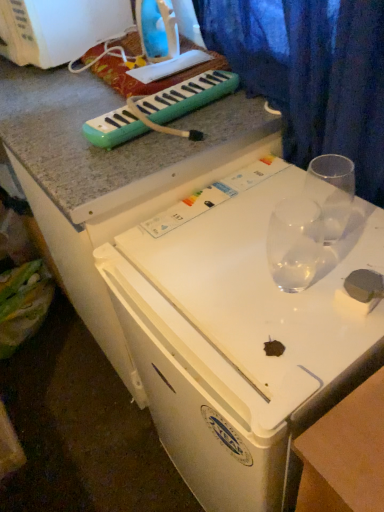
Question: Is transparent glass at upper right, which is the first martini glass in right-to-left order, surrounded by green plastic melodica at upper center?

Choices:
 (A) yes
 (B) no

Answer: (B)

Question: Considering the relative sizes of green plastic melodica at upper center and transparent glass at upper right, the 2th martini glass viewed from the left, in the image provided, is green plastic melodica at upper center bigger than transparent glass at upper right, the 2th martini glass viewed from the left,?

Choices:
 (A) yes
 (B) no

Answer: (A)

Question: From the image's perspective, would you say green plastic melodica at upper center is shown under transparent glass at upper right, which is the first martini glass in right-to-left order?

Choices:
 (A) yes
 (B) no

Answer: (B)

Question: Can you confirm if green plastic melodica at upper center is thinner than transparent glass at upper right, the 2th martini glass viewed from the left?

Choices:
 (A) no
 (B) yes

Answer: (A)

Question: Does green plastic melodica at upper center have a lesser height compared to transparent glass at upper right, which is the first martini glass in right-to-left order?

Choices:
 (A) yes
 (B) no

Answer: (A)

Question: In terms of height, does white plastic washing machine at upper left, which is the 1th appliance from left to right, look taller or shorter compared to blue fabric curtain at upper right?

Choices:
 (A) short
 (B) tall

Answer: (A)

Question: Based on their sizes in the image, would you say white plastic washing machine at upper left, which is the 1th appliance from left to right, is bigger or smaller than blue fabric curtain at upper right?

Choices:
 (A) big
 (B) small

Answer: (B)

Question: Is point (64, 31) positioned closer to the camera than point (301, 96)?

Choices:
 (A) farther
 (B) closer

Answer: (A)

Question: Is white plastic washing machine at upper left, marked as the second appliance in a right-to-left arrangement, inside or outside of blue fabric curtain at upper right?

Choices:
 (A) inside
 (B) outside

Answer: (B)

Question: Does point (331, 236) appear closer or farther from the camera than point (112, 2)?

Choices:
 (A) closer
 (B) farther

Answer: (A)

Question: Considering the positions of transparent glass at upper right, which is the first martini glass in right-to-left order, and white plastic washing machine at upper left, marked as the second appliance in a right-to-left arrangement, in the image, is transparent glass at upper right, which is the first martini glass in right-to-left order, wider or thinner than white plastic washing machine at upper left, marked as the second appliance in a right-to-left arrangement,?

Choices:
 (A) thin
 (B) wide

Answer: (A)

Question: Is transparent glass at upper right, the 2th martini glass viewed from the left, bigger or smaller than white plastic washing machine at upper left, which is the 1th appliance from left to right?

Choices:
 (A) small
 (B) big

Answer: (A)

Question: Would you say transparent glass at upper right, which is the first martini glass in right-to-left order, is to the left or to the right of white plastic washing machine at upper left, which is the 1th appliance from left to right, in the picture?

Choices:
 (A) right
 (B) left

Answer: (A)

Question: From the image's perspective, is white plastic washing machine at upper left, marked as the second appliance in a right-to-left arrangement, located above or below green plastic melodica at upper center?

Choices:
 (A) below
 (B) above

Answer: (B)

Question: Does point (87, 17) appear closer or farther from the camera than point (86, 135)?

Choices:
 (A) farther
 (B) closer

Answer: (A)